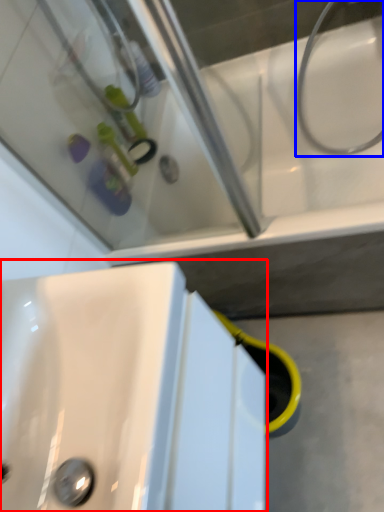
Question: Which of the following is the closest to the observer, sink (highlighted by a red box) or plumbing fixture (highlighted by a blue box)?

Choices:
 (A) sink
 (B) plumbing fixture

Answer: (A)